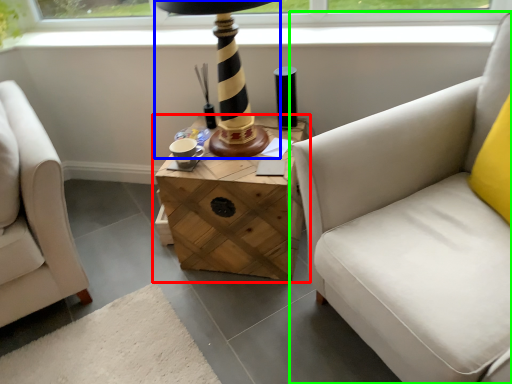
Question: Estimate the real-world distances between objects in this image. Which object is closer to table (highlighted by a red box), table lamp (highlighted by a blue box) or studio couch (highlighted by a green box)?

Choices:
 (A) table lamp
 (B) studio couch

Answer: (A)